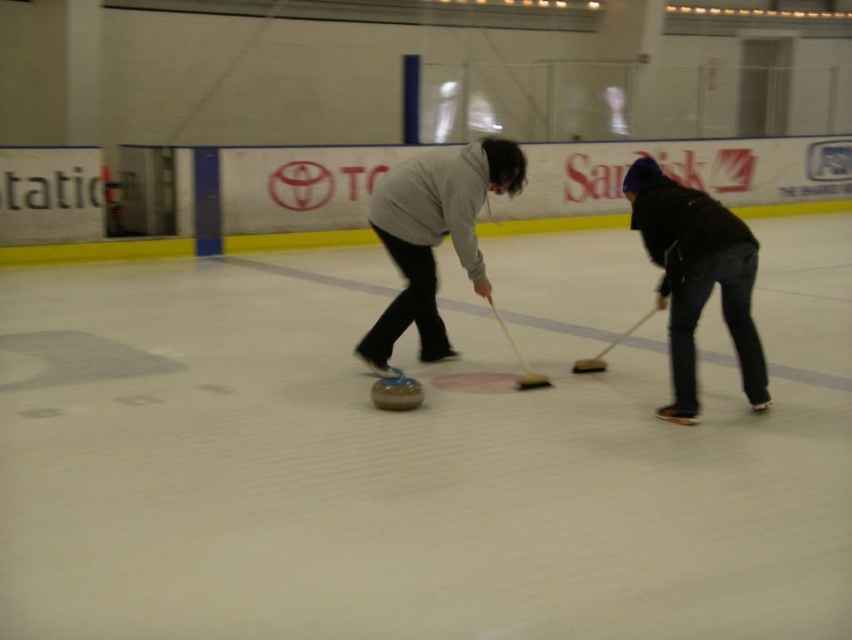
You are a spectator at the curling match and want to take a photo of both the matte gray sweater at center and the smooth brown hockey at center. Which object should you focus on first to ensure both are in clear view?

You should focus on the matte gray sweater at center first because it is closer to you than the smooth brown hockey at center, so focusing on it will also keep the hockey in focus if they are within the same focal range.

From the picture: You are a curling player standing at the point with coordinates (695, 276). Which object is directly in front of you?

The point at (695, 276) is directly in front of the black matte jacket at lower right.

You are a spectator standing at the edge of the ice rink. You see the black matte jacket at lower right and the smooth brown hockey at center. Which object is nearer to you?

The black matte jacket at lower right is closer to the viewer than the smooth brown hockey at center.